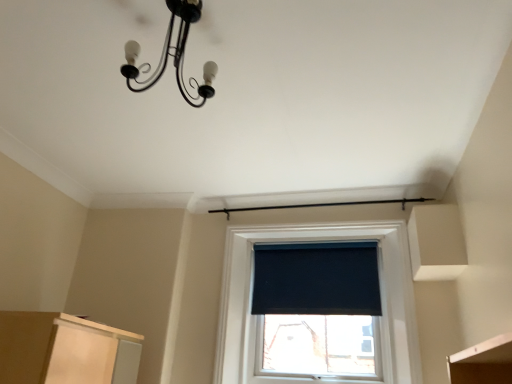
Question: Considering the positions of black matte window screen at center and black matte chandelier at upper center in the image, is black matte window screen at center wider or thinner than black matte chandelier at upper center?

Choices:
 (A) wide
 (B) thin

Answer: (B)

Question: From the image's perspective, relative to black matte chandelier at upper center, is black matte window screen at center above or below?

Choices:
 (A) above
 (B) below

Answer: (B)

Question: Which is correct: black matte window screen at center is inside black matte chandelier at upper center, or outside of it?

Choices:
 (A) inside
 (B) outside

Answer: (B)

Question: Is black matte chandelier at upper center situated inside black matte window screen at center or outside?

Choices:
 (A) outside
 (B) inside

Answer: (A)

Question: From the image's perspective, relative to black matte window screen at center, is black matte chandelier at upper center above or below?

Choices:
 (A) above
 (B) below

Answer: (A)

Question: From a real-world perspective, is black matte chandelier at upper center physically located above or below black matte window screen at center?

Choices:
 (A) below
 (B) above

Answer: (B)

Question: Does point [x=216, y=69] appear closer or farther from the camera than point [x=272, y=281]?

Choices:
 (A) farther
 (B) closer

Answer: (B)